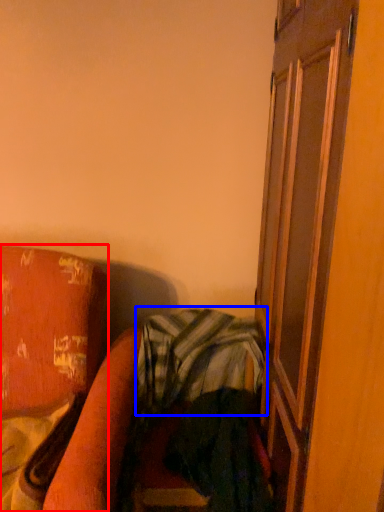
Question: Which point is further to the camera, furniture (highlighted by a red box) or plaid (highlighted by a blue box)?

Choices:
 (A) furniture
 (B) plaid

Answer: (B)